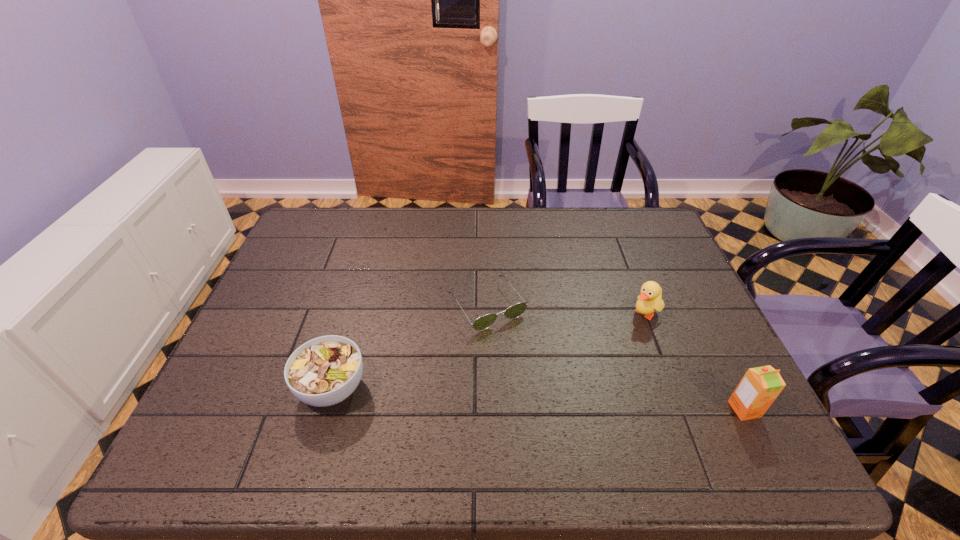
At what (x,y) coordinates should I click in order to perform the action: click on free spot on the desktop that is between the leftmost object and the orange juice and is positioned on the front-facing side of the duckling. Please return your answer as a coordinate pair (x, y). The width and height of the screenshot is (960, 540). Looking at the image, I should click on (538, 399).

Where is `vacant spot on the desktop that is between the soup bowl and the orange juice and is positioned on the front-facing side of the sunglasses`? The height and width of the screenshot is (540, 960). vacant spot on the desktop that is between the soup bowl and the orange juice and is positioned on the front-facing side of the sunglasses is located at coordinates (553, 400).